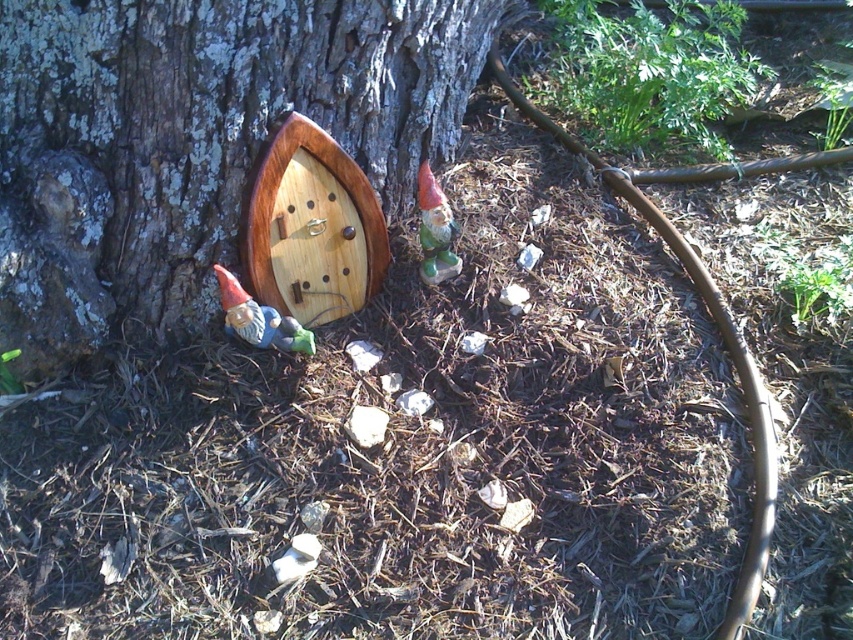
Question: Which point is farther to the camera?

Choices:
 (A) smooth bark tree at center
 (B) matte ceramic gnome at lower left

Answer: (B)

Question: Does smooth bark tree at center appear on the right side of matte ceramic gnome at lower left?

Choices:
 (A) no
 (B) yes

Answer: (A)

Question: Which object appears farthest from the camera in this image?

Choices:
 (A) matte ceramic gnome at lower left
 (B) green matte gnome at center
 (C) smooth bark tree at center

Answer: (B)

Question: Is matte ceramic gnome at lower left positioned behind green matte gnome at center?

Choices:
 (A) no
 (B) yes

Answer: (A)

Question: Which of the following is the closest to the observer?

Choices:
 (A) (62, 125)
 (B) (444, 209)

Answer: (A)

Question: Is smooth bark tree at center positioned behind matte ceramic gnome at lower left?

Choices:
 (A) no
 (B) yes

Answer: (A)